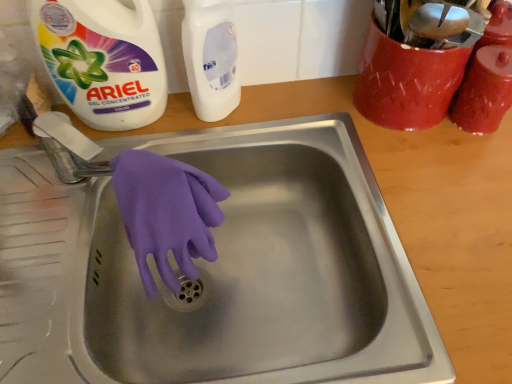
Locate an element on the screen. free spot in front of matte red jar at upper right, the third cleaning product positioned from the left is located at coordinates (463, 185).